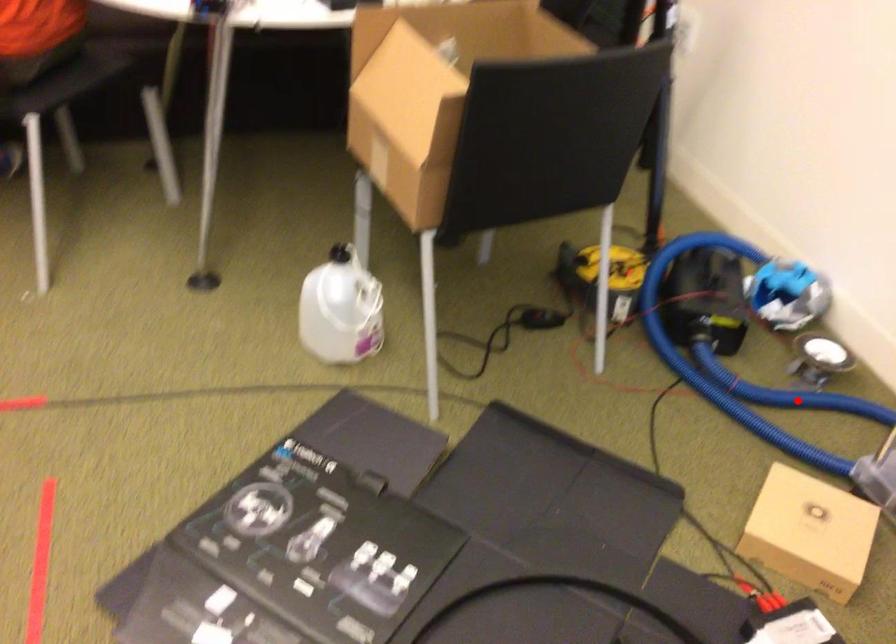
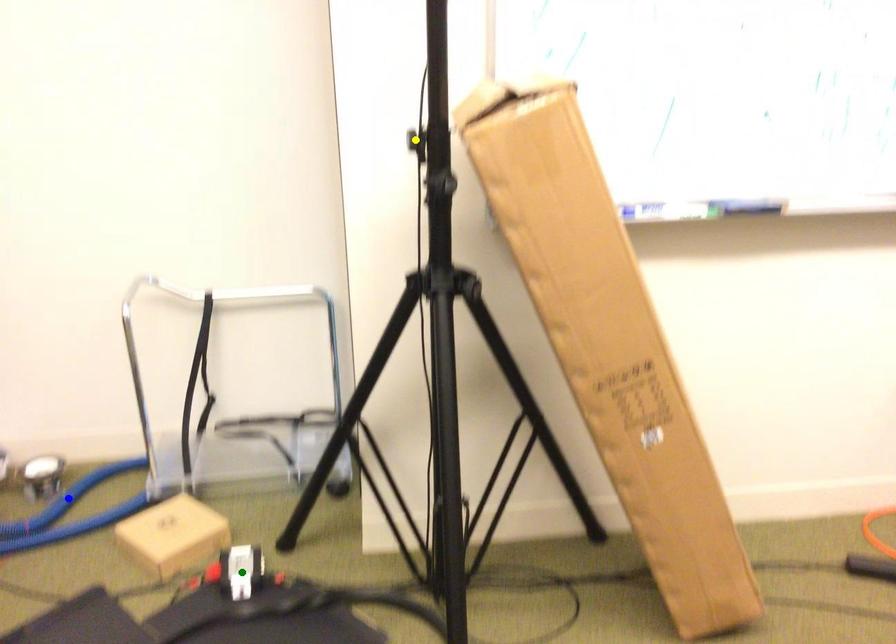
Question: I am providing you with two images of the same scene from different viewpoints. A red point is marked on the first image. You are given multiple points on the second image. Which spot in image 2 lines up with the point in image 1?

Choices:
 (A) yellow point
 (B) green point
 (C) blue point

Answer: (C)